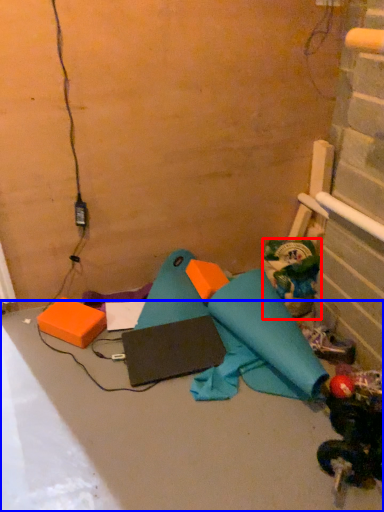
Question: Which object appears closest to the camera in this image, toy (highlighted by a red box) or concrete (highlighted by a blue box)?

Choices:
 (A) toy
 (B) concrete

Answer: (B)